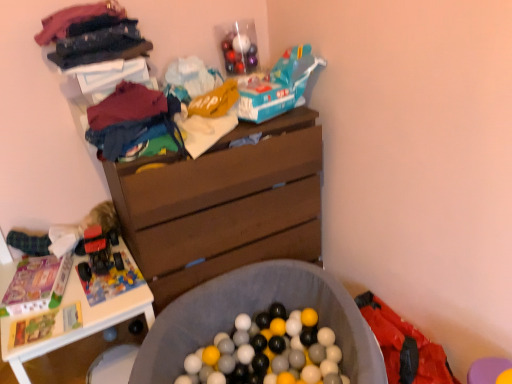
Question: From a real-world perspective, relative to soft gray fabric ball pit at center, is white plastic table at lower left vertically above or below?

Choices:
 (A) above
 (B) below

Answer: (A)

Question: Considering their positions, is white plastic table at lower left located in front of or behind soft gray fabric ball pit at center?

Choices:
 (A) front
 (B) behind

Answer: (B)

Question: Which object is positioned closest to the red fabric underclothes at lower right?

Choices:
 (A) teal plastic toy car at upper center, arranged as the 2th toy car when viewed from the left
 (B) white plastic table at lower left
 (C) matte cotton t-shirt at upper left, the 1th clothing positioned from the bottom
 (D) velvet-like fabric at upper left, which appears as the second clothing when ordered from the bottom
 (E) shiny red plastic toy car at left, which is the 2th toy car from right to left

Answer: (A)

Question: Considering the real-world distances, which object is farthest from the soft gray fabric ball pit at center?

Choices:
 (A) shiny red plastic toy car at left, which ranks as the first toy car in left-to-right order
 (B) white plastic table at lower left
 (C) red fabric underclothes at lower right
 (D) teal plastic toy car at upper center, arranged as the 1th toy car when viewed from the right
 (E) brown wood chest of drawers at center

Answer: (D)